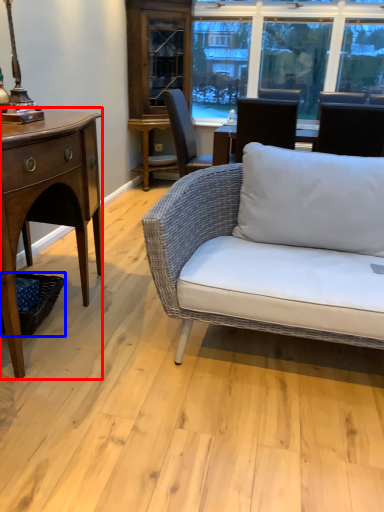
Question: Which object is closer to the camera taking this photo, desk (highlighted by a red box) or picnic basket (highlighted by a blue box)?

Choices:
 (A) desk
 (B) picnic basket

Answer: (A)